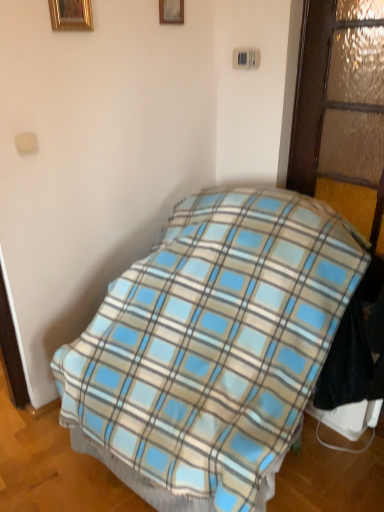
I want to click on gold metallic picture frame at upper left, the second picture frame in the right-to-left sequence, so click(71, 15).

Identify the location of blue plaid blanket at center. This screenshot has height=512, width=384. (212, 348).

In order to click on textured frosted glass door at right in this screenshot , I will do `click(340, 108)`.

At what (x,y) coordinates should I click in order to perform the action: click on wooden picture frame at upper center, which appears as the first picture frame when viewed from the back. Please return your answer as a coordinate pair (x, y). This screenshot has height=512, width=384. Looking at the image, I should click on (171, 11).

From a real-world perspective, who is located higher, textured frosted glass door at right or gold metallic picture frame at upper left, the second picture frame in the right-to-left sequence?

In real-world perspective, gold metallic picture frame at upper left, the second picture frame in the right-to-left sequence, is above.

Consider the image. Measure the distance from textured frosted glass door at right to gold metallic picture frame at upper left, acting as the 1th picture frame starting from the front.

textured frosted glass door at right is 1.03 meters from gold metallic picture frame at upper left, acting as the 1th picture frame starting from the front.

Can you confirm if textured frosted glass door at right is bigger than gold metallic picture frame at upper left, the second picture frame in the right-to-left sequence?

Correct, textured frosted glass door at right is larger in size than gold metallic picture frame at upper left, the second picture frame in the right-to-left sequence.

Is textured frosted glass door at right outside of gold metallic picture frame at upper left, acting as the 1th picture frame starting from the front?

Yes, textured frosted glass door at right is outside of gold metallic picture frame at upper left, acting as the 1th picture frame starting from the front.

Does point (260, 232) come farther from viewer compared to point (85, 13)?

No, (260, 232) is in front of (85, 13).

From a real-world perspective, which is physically below, blue plaid blanket at center or gold metallic picture frame at upper left, the second picture frame in the right-to-left sequence?

In real-world perspective, blue plaid blanket at center is lower.

Is gold metallic picture frame at upper left, acting as the 1th picture frame starting from the front, at the back of blue plaid blanket at center?

No, gold metallic picture frame at upper left, acting as the 1th picture frame starting from the front, is not at the back of blue plaid blanket at center.

From a real-world perspective, does blue plaid blanket at center stand above wooden picture frame at upper center, the 2th picture frame when ordered from front to back?

No, from a real-world perspective, blue plaid blanket at center is not above wooden picture frame at upper center, the 2th picture frame when ordered from front to back.

Is blue plaid blanket at center directly adjacent to wooden picture frame at upper center, which appears as the first picture frame when viewed from the back?

No, blue plaid blanket at center is not touching wooden picture frame at upper center, which appears as the first picture frame when viewed from the back.

In the scene shown: From a real-world perspective, is wooden picture frame at upper center, placed as the first picture frame when sorted from right to left, positioned above or below textured frosted glass door at right?

wooden picture frame at upper center, placed as the first picture frame when sorted from right to left, is above textured frosted glass door at right.

Considering the sizes of wooden picture frame at upper center, placed as the first picture frame when sorted from right to left, and textured frosted glass door at right in the image, is wooden picture frame at upper center, placed as the first picture frame when sorted from right to left, taller or shorter than textured frosted glass door at right?

In the image, wooden picture frame at upper center, placed as the first picture frame when sorted from right to left, appears to be shorter than textured frosted glass door at right.

Which point is more forward, (178, 20) or (313, 186)?

Point (178, 20)

From the picture: Choose the correct answer: Is wooden picture frame at upper center, arranged as the 2th picture frame when viewed from the left, inside textured frosted glass door at right or outside it?

wooden picture frame at upper center, arranged as the 2th picture frame when viewed from the left, lies outside textured frosted glass door at right.

Is the depth of blue plaid blanket at center less than that of textured frosted glass door at right?

Yes, blue plaid blanket at center is closer to the camera.

Find the location of a particular element. bed in front of the textured frosted glass door at right is located at coordinates (212, 348).

Choose the correct answer: Is blue plaid blanket at center inside textured frosted glass door at right or outside it?

blue plaid blanket at center is located beyond the bounds of textured frosted glass door at right.

Considering the positions of points (354, 142) and (182, 5), is point (354, 142) farther from camera compared to point (182, 5)?

That is False.

Considering the sizes of objects textured frosted glass door at right and wooden picture frame at upper center, placed as the first picture frame when sorted from right to left, in the image provided, who is bigger, textured frosted glass door at right or wooden picture frame at upper center, placed as the first picture frame when sorted from right to left,?

textured frosted glass door at right.

Is textured frosted glass door at right oriented towards wooden picture frame at upper center, arranged as the 2th picture frame when viewed from the left?

No, textured frosted glass door at right does not turn towards wooden picture frame at upper center, arranged as the 2th picture frame when viewed from the left.

Considering their positions, is textured frosted glass door at right located in front of or behind wooden picture frame at upper center, the 2th picture frame when ordered from front to back?

textured frosted glass door at right is positioned closer to the viewer than wooden picture frame at upper center, the 2th picture frame when ordered from front to back.

How different are the orientations of textured frosted glass door at right and blue plaid blanket at center in degrees?

The angular difference between textured frosted glass door at right and blue plaid blanket at center is 6.41 degrees.

From a real-world perspective, who is located higher, textured frosted glass door at right or blue plaid blanket at center?

textured frosted glass door at right is physically above.

Is there a large distance between textured frosted glass door at right and blue plaid blanket at center?

No, textured frosted glass door at right is in close proximity to blue plaid blanket at center.

From the image's perspective, does textured frosted glass door at right appear higher than blue plaid blanket at center?

Indeed, from the image's perspective, textured frosted glass door at right is shown above blue plaid blanket at center.

Where is `the 2nd picture frame counting from the left of the textured frosted glass door at right`? Image resolution: width=384 pixels, height=512 pixels. the 2nd picture frame counting from the left of the textured frosted glass door at right is located at coordinates (71, 15).

Where is `bed below the gold metallic picture frame at upper left, acting as the 1th picture frame starting from the front (from a real-world perspective)`? The width and height of the screenshot is (384, 512). bed below the gold metallic picture frame at upper left, acting as the 1th picture frame starting from the front (from a real-world perspective) is located at coordinates (212, 348).

Looking at this image, when comparing their distances from gold metallic picture frame at upper left, the second picture frame in the right-to-left sequence, does wooden picture frame at upper center, which appears as the first picture frame when viewed from the back, or blue plaid blanket at center seem further?

blue plaid blanket at center.

Looking at the image, which one is located further to wooden picture frame at upper center, which appears as the first picture frame when viewed from the back, textured frosted glass door at right or gold metallic picture frame at upper left, the first picture frame viewed from the left?

textured frosted glass door at right is positioned further to the anchor wooden picture frame at upper center, which appears as the first picture frame when viewed from the back.

Looking at the image, which one is located further to gold metallic picture frame at upper left, the second picture frame in the right-to-left sequence, textured frosted glass door at right or wooden picture frame at upper center, which appears as the first picture frame when viewed from the back?

The object further to gold metallic picture frame at upper left, the second picture frame in the right-to-left sequence, is textured frosted glass door at right.

Estimate the real-world distances between objects in this image. Which object is closer to gold metallic picture frame at upper left, the second picture frame in the right-to-left sequence, blue plaid blanket at center or wooden picture frame at upper center, the 2th picture frame when ordered from front to back?

wooden picture frame at upper center, the 2th picture frame when ordered from front to back, is closer to gold metallic picture frame at upper left, the second picture frame in the right-to-left sequence.

Estimate the real-world distances between objects in this image. Which object is further from textured frosted glass door at right, gold metallic picture frame at upper left, the first picture frame viewed from the left, or blue plaid blanket at center?

The object further to textured frosted glass door at right is gold metallic picture frame at upper left, the first picture frame viewed from the left.

From the image, which object appears to be farther from textured frosted glass door at right, wooden picture frame at upper center, the 2th picture frame when ordered from front to back, or blue plaid blanket at center?

wooden picture frame at upper center, the 2th picture frame when ordered from front to back.

Which object lies further to the anchor point blue plaid blanket at center, wooden picture frame at upper center, placed as the first picture frame when sorted from right to left, or gold metallic picture frame at upper left, which is the second picture frame in back-to-front order?

The object further to blue plaid blanket at center is wooden picture frame at upper center, placed as the first picture frame when sorted from right to left.

Which object lies further to the anchor point gold metallic picture frame at upper left, the first picture frame viewed from the left, wooden picture frame at upper center, arranged as the 2th picture frame when viewed from the left, or textured frosted glass door at right?

The object further to gold metallic picture frame at upper left, the first picture frame viewed from the left, is textured frosted glass door at right.

I want to click on picture frame between wooden picture frame at upper center, the 2th picture frame when ordered from front to back, and blue plaid blanket at center vertically, so click(x=71, y=15).

The width and height of the screenshot is (384, 512). I want to click on glass door between wooden picture frame at upper center, the 2th picture frame when ordered from front to back, and blue plaid blanket at center in the up-down direction, so click(x=340, y=108).

The width and height of the screenshot is (384, 512). What are the coordinates of `glass door between gold metallic picture frame at upper left, acting as the 1th picture frame starting from the front, and blue plaid blanket at center vertically` in the screenshot? It's located at (340, 108).

At what (x,y) coordinates should I click in order to perform the action: click on picture frame between gold metallic picture frame at upper left, which is the second picture frame in back-to-front order, and textured frosted glass door at right. Please return your answer as a coordinate pair (x, y). This screenshot has height=512, width=384. Looking at the image, I should click on (171, 11).